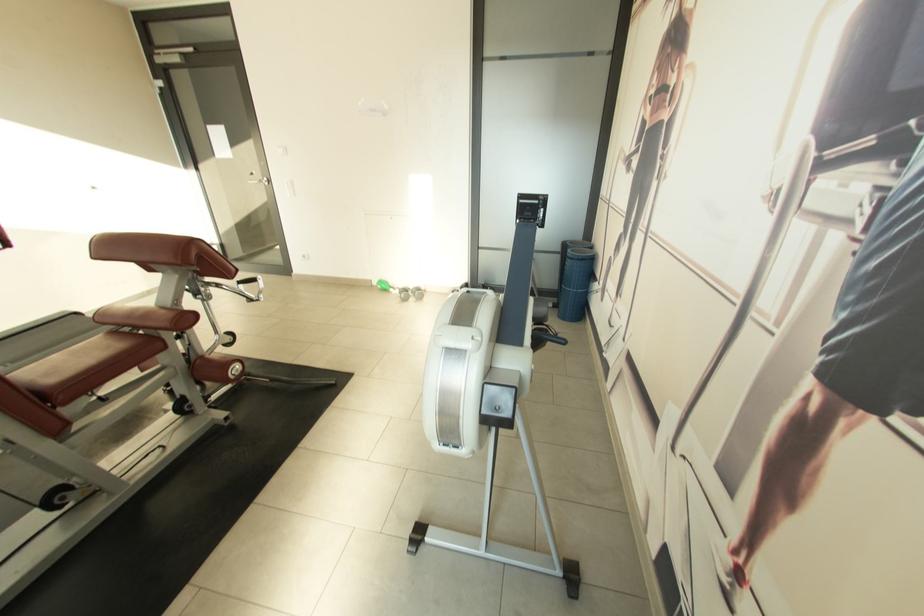
What do you see at coordinates (259, 180) in the screenshot?
I see `the silver door handle` at bounding box center [259, 180].